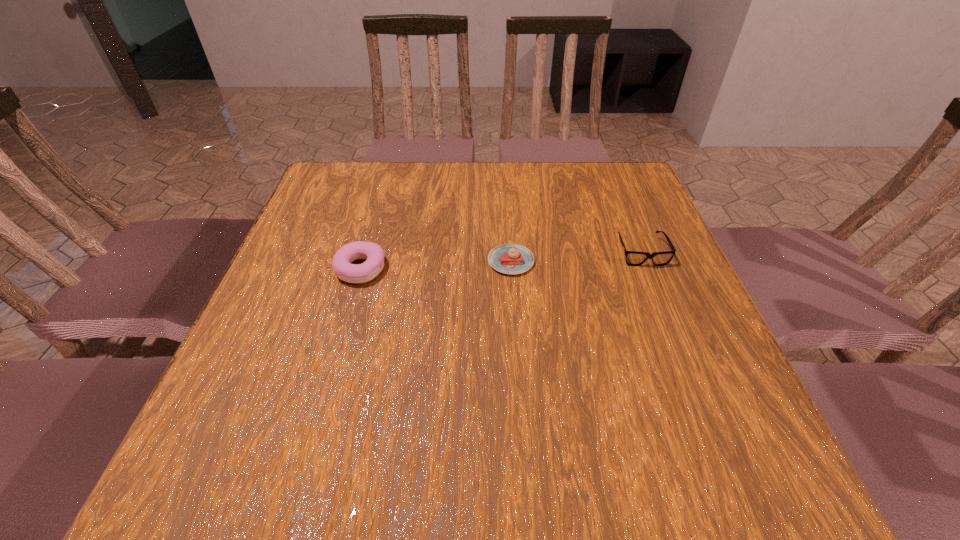
Locate an element on the screen. the taller pastry is located at coordinates (373, 253).

Image resolution: width=960 pixels, height=540 pixels. I want to click on the left pastry, so click(373, 253).

Where is `sunglasses`? Image resolution: width=960 pixels, height=540 pixels. sunglasses is located at coordinates (633, 258).

Identify the location of the second object from right to left. (509, 258).

Locate an element on the screen. the shorter pastry is located at coordinates (509, 258).

Identify the location of vacant area situated on the back of the taller pastry. The height and width of the screenshot is (540, 960). (385, 183).

This screenshot has height=540, width=960. What are the coordinates of `free location located on the front-facing side of the rightmost object` in the screenshot? It's located at (676, 338).

Where is `free point located 0.050m on the right of the second object from left to right`? free point located 0.050m on the right of the second object from left to right is located at coordinates (556, 261).

Locate an element on the screen. object positioned at the left edge is located at coordinates (x=373, y=253).

At what (x,y) coordinates should I click in order to perform the action: click on object located in the right edge section of the desktop. Please return your answer as a coordinate pair (x, y). Looking at the image, I should click on (633, 258).